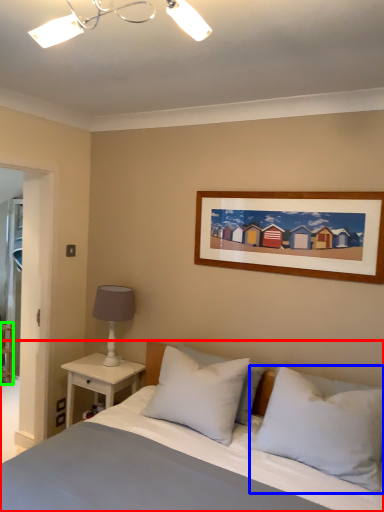
Question: Which is nearer to the bed (highlighted by a red box)? pillow (highlighted by a blue box) or shelf (highlighted by a green box).

Choices:
 (A) pillow
 (B) shelf

Answer: (A)